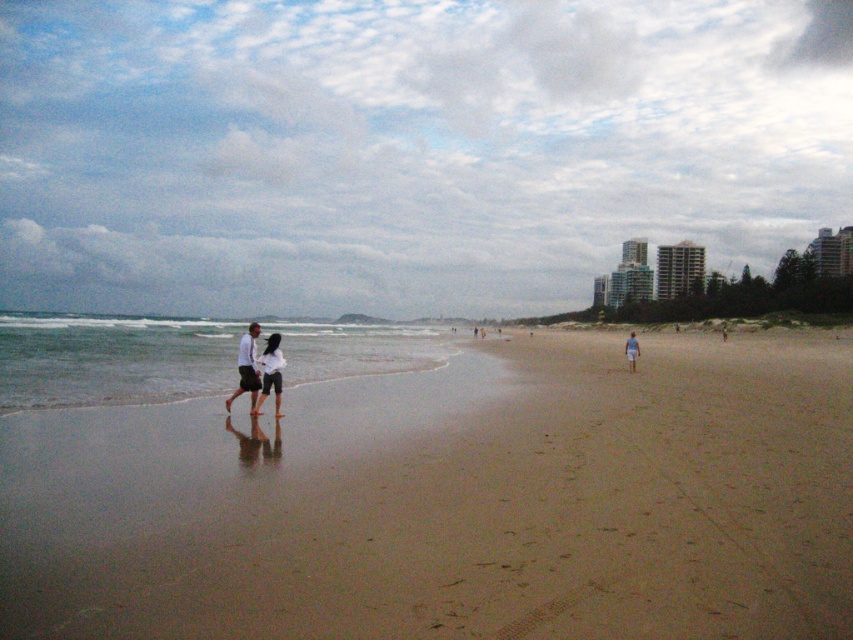
Between point (256, 413) and point (625, 342), which one is positioned in front?

Point (256, 413) is more forward.

Looking at this image, is matte white shirt at center thinner than white fabric shorts at center?

Yes.

Between point (277, 400) and point (631, 369), which one is positioned behind?

Positioned behind is point (631, 369).

The image size is (853, 640). Find the location of `matte white shirt at center`. matte white shirt at center is located at coordinates (247, 369).

Is point (264, 384) positioned after point (630, 342)?

No, (264, 384) is closer to viewer.

Image resolution: width=853 pixels, height=640 pixels. Describe the element at coordinates (271, 371) in the screenshot. I see `white cotton shorts at center` at that location.

Where is `white cotton shorts at center`? white cotton shorts at center is located at coordinates (271, 371).

This screenshot has height=640, width=853. What are the coordinates of `white cotton shorts at center` in the screenshot? It's located at (271, 371).

The height and width of the screenshot is (640, 853). What are the coordinates of `brown sandy beach at center` in the screenshot? It's located at (453, 500).